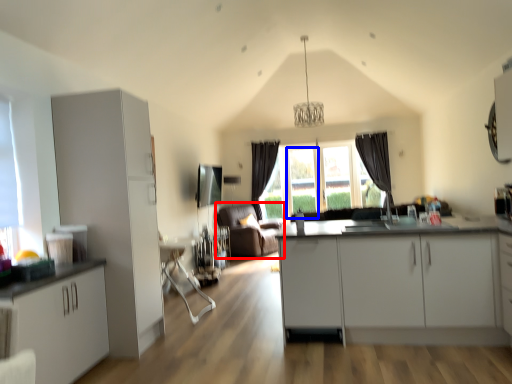
Question: Which object is closer to the camera taking this photo, couch (highlighted by a red box) or glass door (highlighted by a blue box)?

Choices:
 (A) couch
 (B) glass door

Answer: (A)